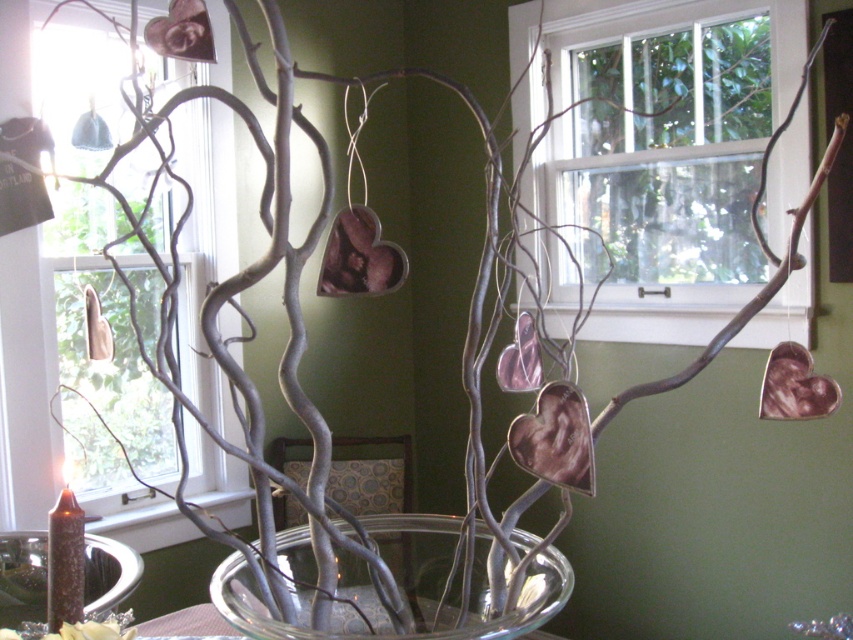
Is clear glass bowl at center taller than metallic silver flower at lower left?

In fact, clear glass bowl at center may be shorter than metallic silver flower at lower left.

Between point (490, 620) and point (109, 616), which one is positioned behind?

The point (109, 616) is more distant.

Is point (437, 636) positioned before point (76, 625)?

No, (437, 636) is further to viewer.

Identify the location of clear glass bowl at center. The height and width of the screenshot is (640, 853). click(x=396, y=582).

Who is higher up, clear glass bowl at lower left or metallic silver flower at lower left?

metallic silver flower at lower left is higher up.

Can you confirm if clear glass bowl at lower left is shorter than metallic silver flower at lower left?

Yes, clear glass bowl at lower left is shorter than metallic silver flower at lower left.

Does point (42, 564) come farther from viewer compared to point (65, 627)?

Yes, it is behind point (65, 627).

In order to click on clear glass bowl at lower left in this screenshot , I will do `click(22, 577)`.

What are the coordinates of `clear glass bowl at center` in the screenshot? It's located at (396, 582).

Where is `clear glass bowl at center`? Image resolution: width=853 pixels, height=640 pixels. clear glass bowl at center is located at coordinates (396, 582).